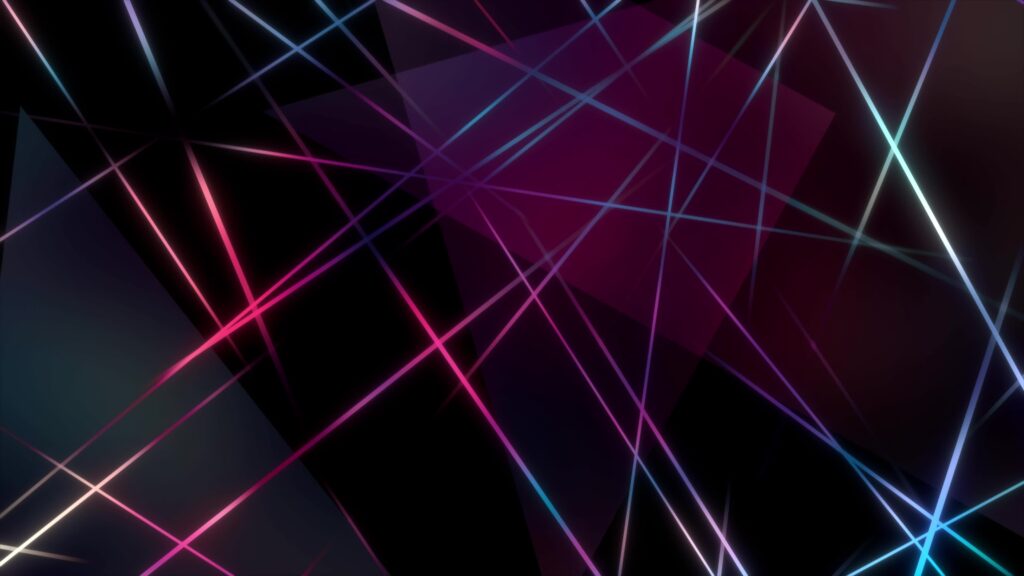
The image size is (1024, 576). Find the location of `light`. light is located at coordinates (445, 348).